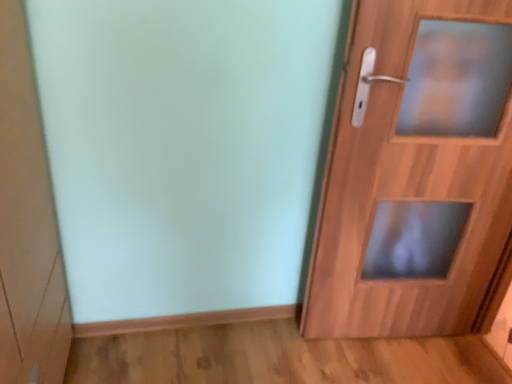
You are a GUI agent. You are given a task and a screenshot of the screen. Output one action in this format:
    pyautogui.click(x=<x>, y=<y>)
    Task: Click on the vacant area to the right of matte white cabinet at left
    Image resolution: width=512 pixels, height=384 pixels.
    Given the screenshot: What is the action you would take?
    pyautogui.click(x=122, y=364)